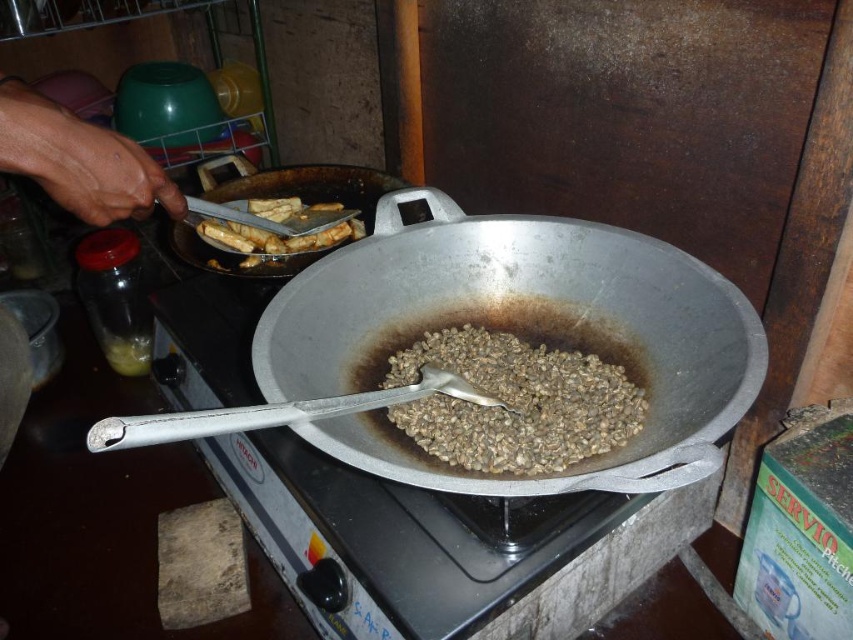
Can you confirm if silver metallic frying pan at center is thinner than brown crispy fried food at upper left?

In fact, silver metallic frying pan at center might be wider than brown crispy fried food at upper left.

Can you confirm if silver metallic frying pan at center is shorter than brown crispy fried food at upper left?

No.

Between point (422, 202) and point (254, 232), which one is positioned in front?

Positioned in front is point (254, 232).

The width and height of the screenshot is (853, 640). In order to click on silver metallic frying pan at center in this screenshot , I will do `click(312, 186)`.

Who is positioned more to the left, shiny silver wok at center or brown matte beans at center?

Positioned to the left is shiny silver wok at center.

Is shiny silver wok at center to the right of brown matte beans at center from the viewer's perspective?

In fact, shiny silver wok at center is to the left of brown matte beans at center.

Is point (581, 337) in front of point (460, 413)?

That is False.

At what (x,y) coordinates should I click in order to perform the action: click on shiny silver wok at center. Please return your answer as a coordinate pair (x, y). Looking at the image, I should click on (520, 333).

Locate an element on the screen. This screenshot has width=853, height=640. shiny silver wok at center is located at coordinates (520, 333).

Can you confirm if shiny silver wok at center is positioned above silver metallic frying pan at center?

Incorrect, shiny silver wok at center is not positioned above silver metallic frying pan at center.

Who is more distant from viewer, (323, 432) or (323, 195)?

Point (323, 195)

I want to click on shiny silver wok at center, so click(x=520, y=333).